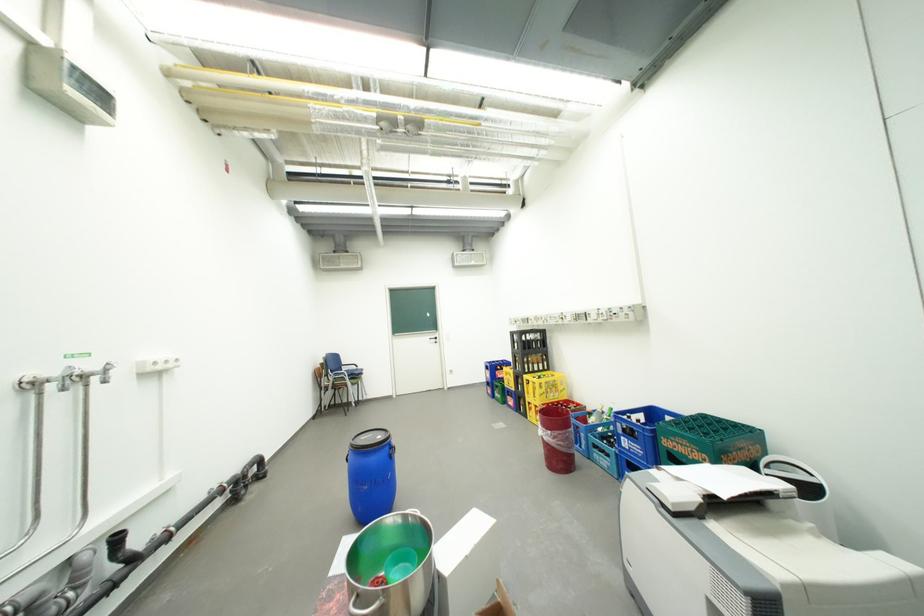
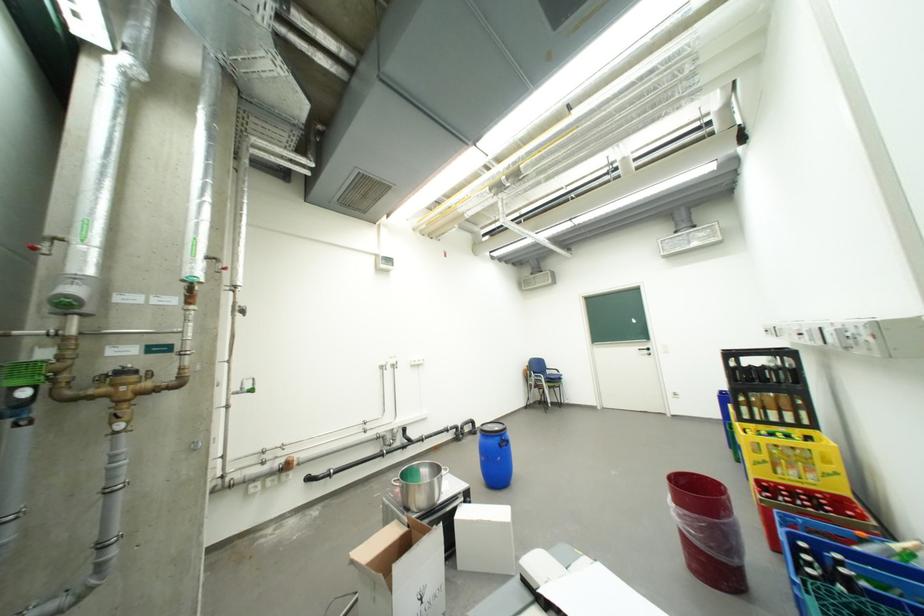
In the second image, find the point that corresponds to the point at 560,434 in the first image.

(685, 507)